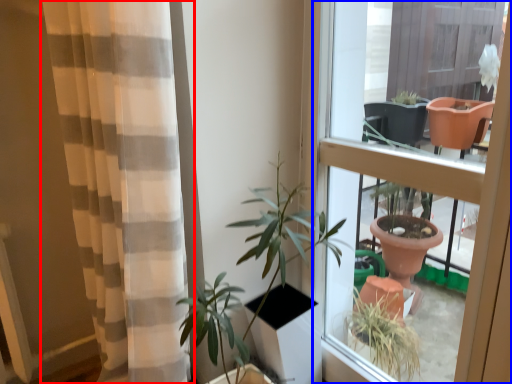
Question: Which object appears farthest to the camera in this image, curtain (highlighted by a red box) or window (highlighted by a blue box)?

Choices:
 (A) curtain
 (B) window

Answer: (B)